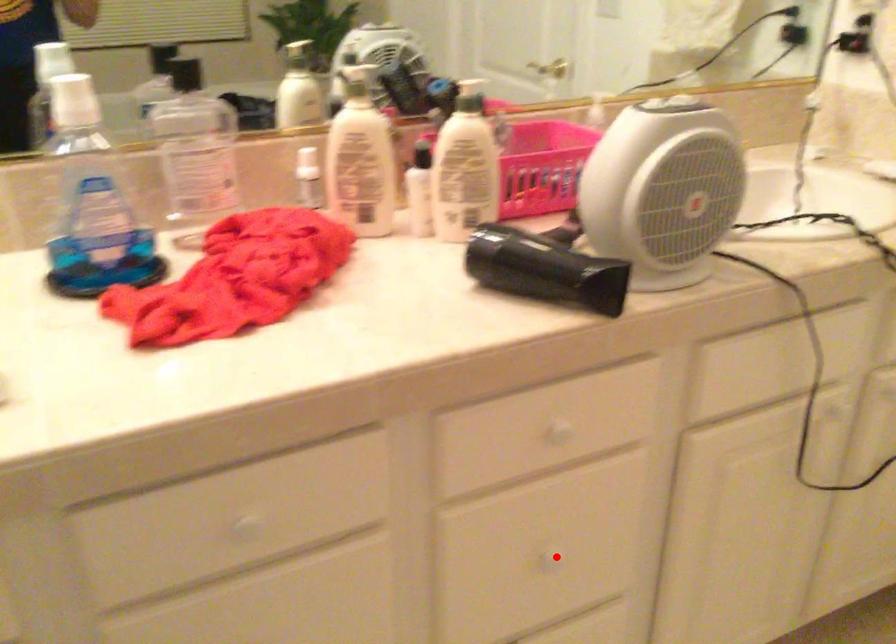
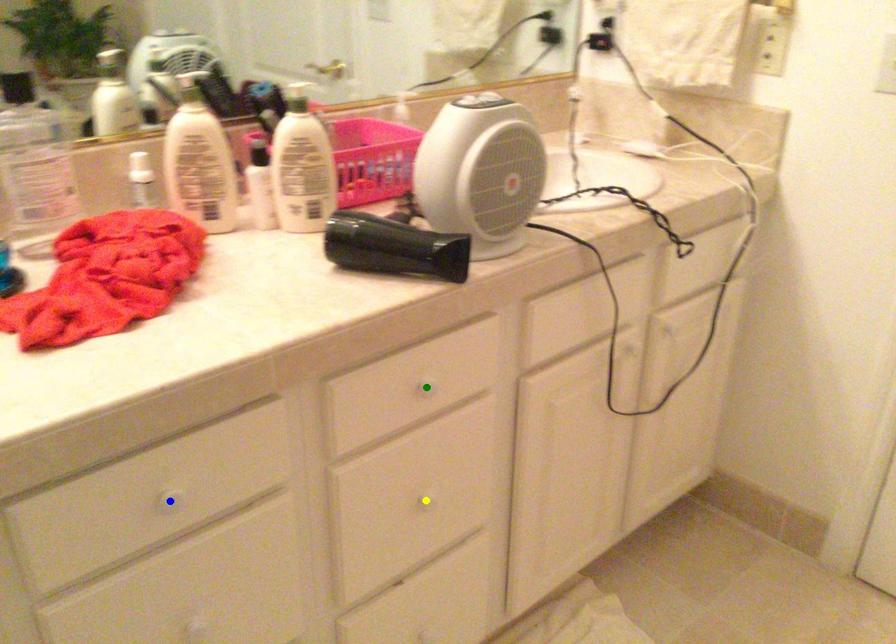
Question: I am providing you with two images of the same scene from different viewpoints. A red point is marked on the first image. You are given multiple points on the second image. Can you choose the point in image 2 that corresponds to the point in image 1?

Choices:
 (A) yellow point
 (B) blue point
 (C) green point

Answer: (A)